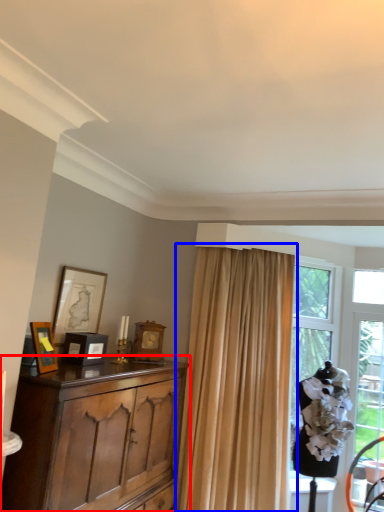
Question: Which object appears farthest to the camera in this image, cabinetry (highlighted by a red box) or curtain (highlighted by a blue box)?

Choices:
 (A) cabinetry
 (B) curtain

Answer: (B)